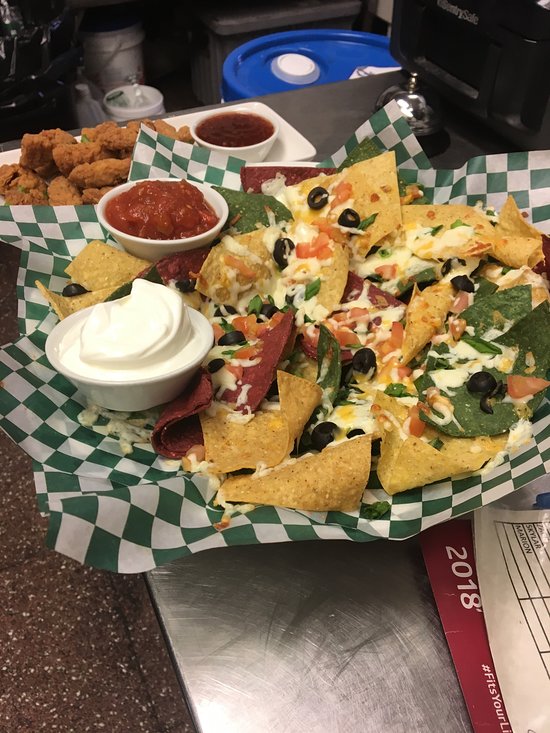
Where is `white dip bowls`? white dip bowls is located at coordinates (256, 146), (146, 391), (159, 246).